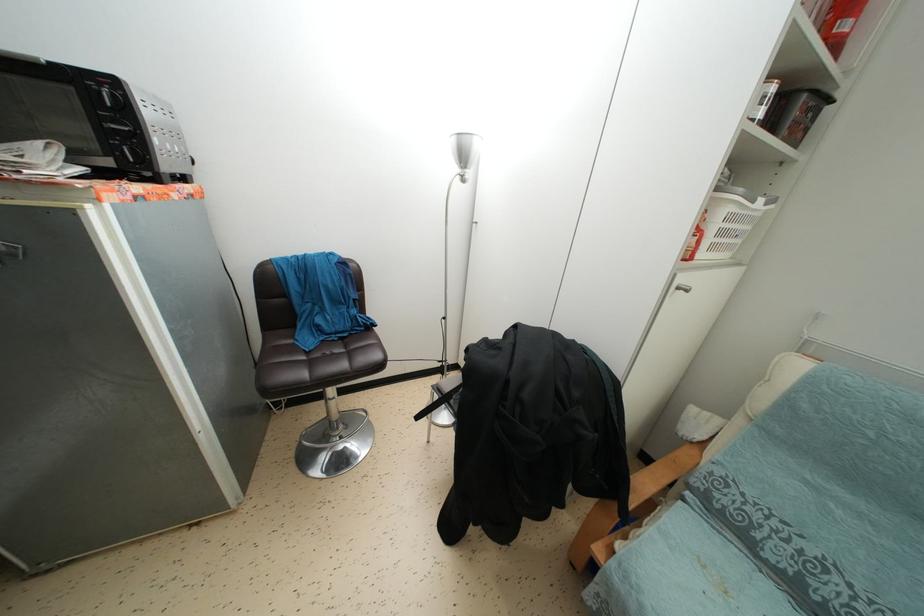
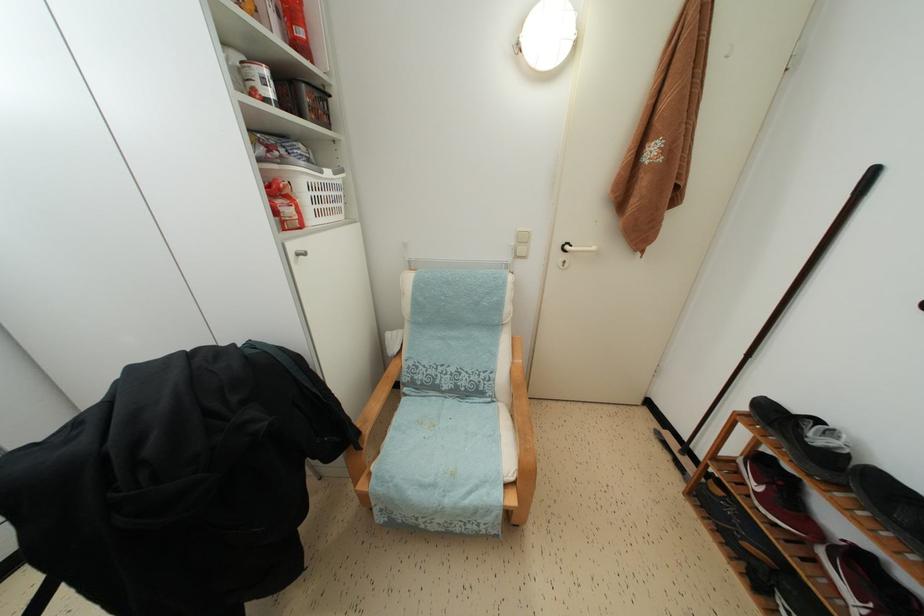
Find the pixel in the second image that matches [848,31] in the first image.

(305, 38)